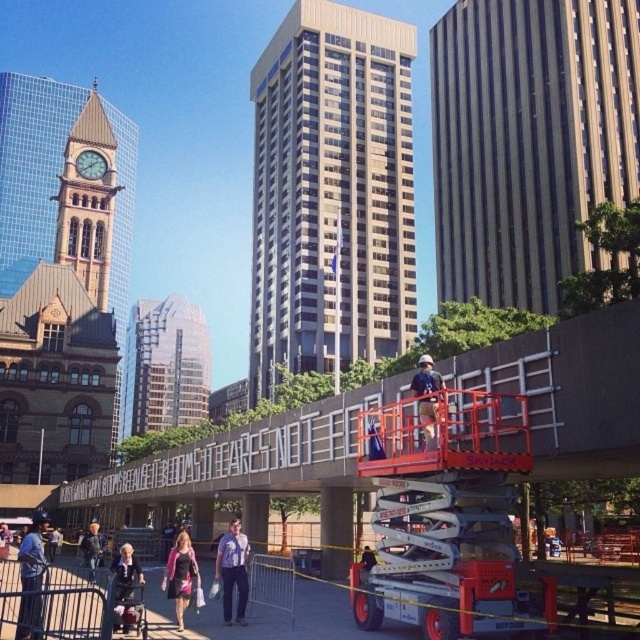
Question: Based on their relative distances, which object is farther from the brown textured building at upper right?

Choices:
 (A) matte pink dress at center
 (B) metallic silver barrier at lower center
 (C) white concrete sign at center

Answer: (A)

Question: Is brown brick clock tower at left closer to camera compared to denim jacket at lower left?

Choices:
 (A) yes
 (B) no

Answer: (B)

Question: Can you confirm if gold glass skyscraper at center is bigger than brown brick clock tower at left?

Choices:
 (A) no
 (B) yes

Answer: (A)

Question: Which point appears farthest from the camera in this image?

Choices:
 (A) (225, 538)
 (B) (326, 624)
 (C) (22, 624)

Answer: (A)

Question: Which point appears farthest from the camera in this image?

Choices:
 (A) (x=29, y=116)
 (B) (x=19, y=561)

Answer: (A)

Question: Is brown brick clock tower at left smaller than glassy reflective skyscraper at center?

Choices:
 (A) yes
 (B) no

Answer: (B)